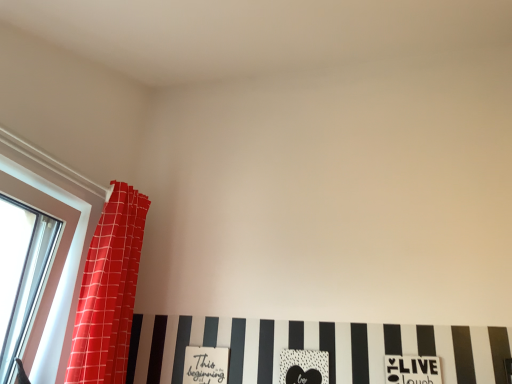
Question: Is point (282, 370) closer or farther from the camera than point (420, 357)?

Choices:
 (A) closer
 (B) farther

Answer: (B)

Question: Considering their positions, is black matte heart at center, placed as the second print when sorted from left to right, located in front of or behind white matte print at lower center, the 1th print in the right-to-left sequence?

Choices:
 (A) front
 (B) behind

Answer: (B)

Question: Which object is positioned farthest from the clear glass window at left?

Choices:
 (A) white matte print at lower center, the third print from the left
 (B) red fabric curtain at left
 (C) matte white sign at lower center, which is the third print from right to left
 (D) black matte heart at center, placed as the second print when sorted from left to right

Answer: (A)

Question: Based on their relative distances, which object is farther from the white matte print at lower center, the 1th print in the right-to-left sequence?

Choices:
 (A) matte white sign at lower center, which is the 1th print in left-to-right order
 (B) clear glass window at left
 (C) red fabric curtain at left
 (D) black matte heart at center, placed as the second print when sorted from right to left

Answer: (B)